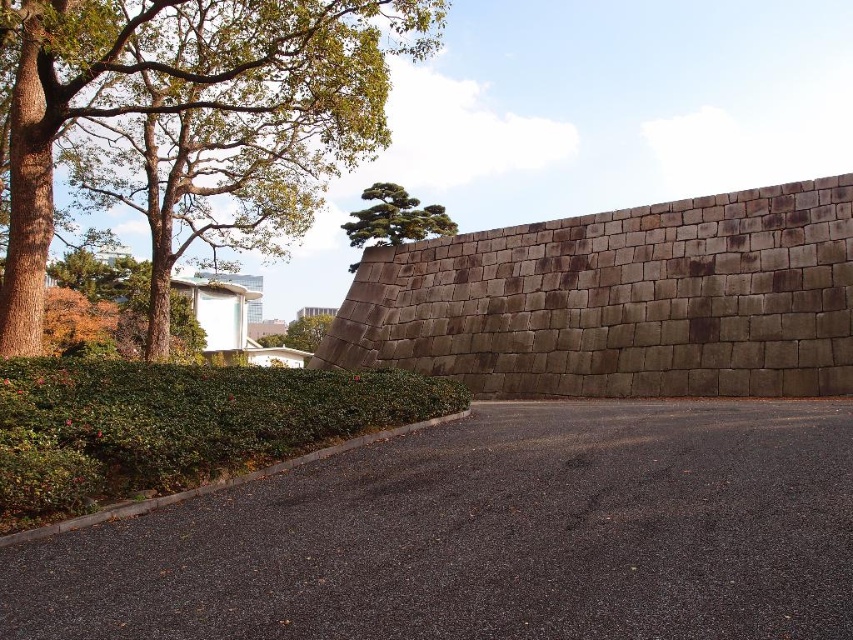
Question: From the image, what is the correct spatial relationship of green leafy hedge at lower left in relation to green textured stone wall at upper center?

Choices:
 (A) below
 (B) above

Answer: (A)

Question: Which object is farther from the camera taking this photo?

Choices:
 (A) green leafy tree at center
 (B) green textured stone wall at upper center
 (C) green leafy tree at left
 (D) green leafy hedge at lower left

Answer: (A)

Question: Can you confirm if green leafy tree at left is positioned above green textured stone wall at upper center?

Choices:
 (A) no
 (B) yes

Answer: (B)

Question: Does green leafy hedge at lower left have a smaller size compared to green leafy tree at center?

Choices:
 (A) no
 (B) yes

Answer: (B)

Question: Which point is farther from the camera taking this photo?

Choices:
 (A) (119, 72)
 (B) (22, 493)
 (C) (396, 212)
 (D) (297, 346)

Answer: (D)

Question: Among these points, which one is nearest to the camera?

Choices:
 (A) [97, 36]
 (B) [315, 336]

Answer: (A)